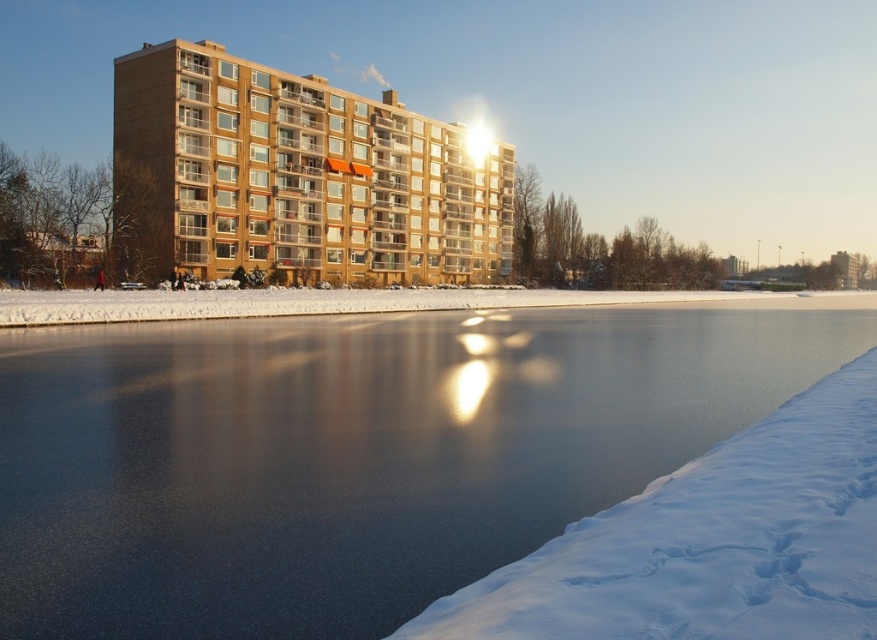
You are a photographer planning to capture the brown glass building at center and the white powdery snow at lower right in a single frame. Given that your camera can only focus on objects within a 10m width, will both objects fit in the frame?

The brown glass building at center is wider than the white powdery snow at lower right. However, since the camera can focus on objects within a 10m width, both objects will fit in the frame as long as their combined width does not exceed 10m. However, the exact dimensions are not provided, so it depends on their actual widths.

You are a delivery person needing to cross the frozen lake to reach the residential building. The smooth ice at lower center and the white powdery snow at lower right are both in your path. Which surface should you choose to ensure safe passage, considering their widths?

The smooth ice at lower center has a greater width than the white powdery snow at lower right, so it is safer to choose the smooth ice at lower center for crossing since it is wider and more stable.

You are an ice skater standing on the smooth ice at lower center. You want to reach the brown glass building at center. Can you skate directly to it without leaving the ice?

The smooth ice at lower center is narrower than the brown glass building at center, so you can skate directly to it without leaving the ice as the ice extends under the building.